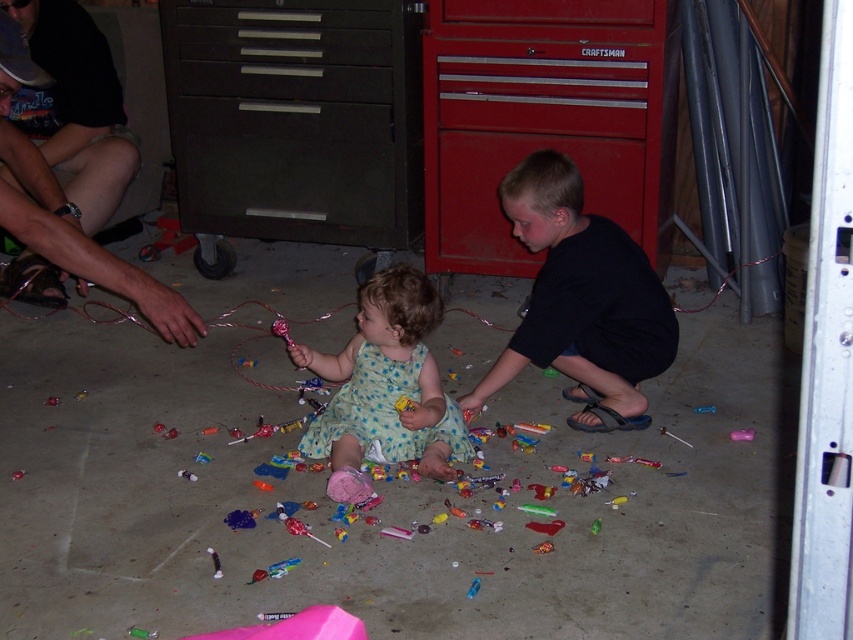
Question: Among these objects, which one is farthest from the camera?

Choices:
 (A) brown leather sandal at left
 (B) floral dress at center

Answer: (A)

Question: Estimate the real-world distances between objects in this image. Which object is closer to the brown leather sandal at left?

Choices:
 (A) black matte shirt at center
 (B) floral dress at center

Answer: (B)

Question: Does black matte shirt at center appear on the right side of brown leather sandal at left?

Choices:
 (A) no
 (B) yes

Answer: (B)

Question: Which point is closer to the camera?

Choices:
 (A) floral dress at center
 (B) brown leather sandal at left

Answer: (A)

Question: Does black matte shirt at center have a lesser width compared to floral dress at center?

Choices:
 (A) yes
 (B) no

Answer: (B)

Question: Can you confirm if brown leather sandal at left is positioned to the right of floral dress at center?

Choices:
 (A) no
 (B) yes

Answer: (A)